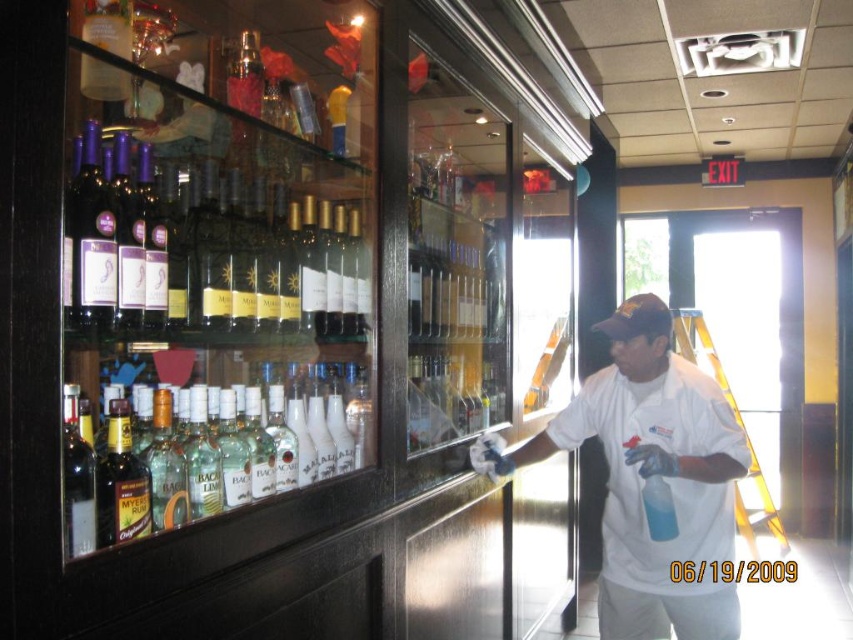
Question: Can you confirm if matte purple wine at upper left is positioned above clear glass bottles at center?

Choices:
 (A) yes
 (B) no

Answer: (A)

Question: Which object is positioned farthest from the matte purple wine at upper left?

Choices:
 (A) clear glass bottles at center
 (B) white cloth shirt at right
 (C) dark amber glass bottle at center left
 (D) matte black wine bottle at left

Answer: (B)

Question: Does matte purple wine at upper left appear on the left side of white cloth shirt at right?

Choices:
 (A) no
 (B) yes

Answer: (B)

Question: Which object is positioned farthest from the matte black wine bottle at left?

Choices:
 (A) white cloth shirt at right
 (B) dark amber glass bottle at center left
 (C) matte purple wine at upper left
 (D) clear glass bottles at center

Answer: (A)

Question: Among these objects, which one is nearest to the camera?

Choices:
 (A) clear glass bottles at center
 (B) dark amber glass bottle at center left
 (C) matte purple wine at upper left
 (D) white cloth shirt at right

Answer: (A)

Question: Can you confirm if white cloth shirt at right is wider than clear glass bottles at center?

Choices:
 (A) yes
 (B) no

Answer: (A)